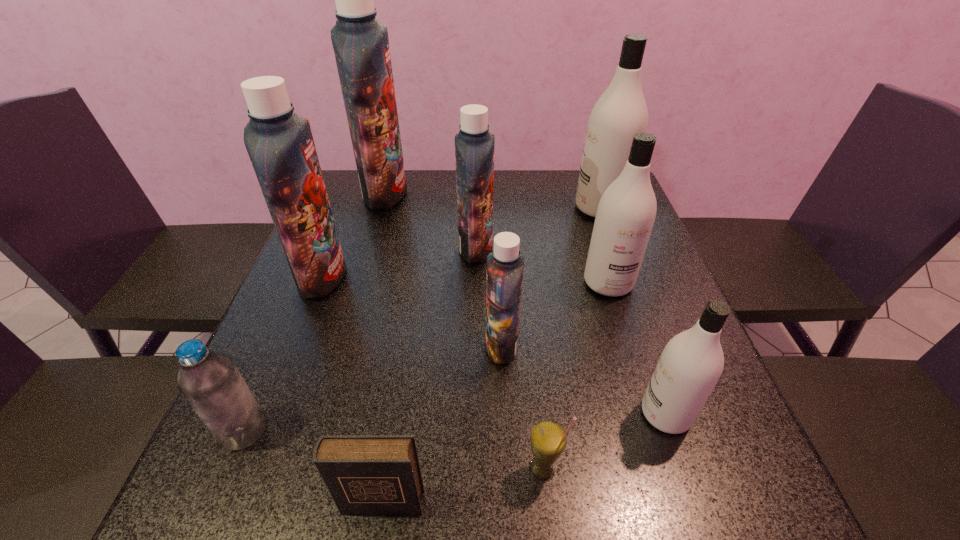
Where is `straw for drinking located at the near edge`? straw for drinking located at the near edge is located at coordinates (548, 438).

Locate an element on the screen. diary situated at the near edge is located at coordinates coord(365,474).

I want to click on water bottle that is at the left edge, so click(209, 380).

The height and width of the screenshot is (540, 960). What are the coordinates of `object that is at the far left corner` in the screenshot? It's located at (361, 45).

What are the coordinates of `object that is at the far right corner` in the screenshot? It's located at (621, 111).

Identify the location of vacant position at the far edge of the desktop. The width and height of the screenshot is (960, 540). (497, 199).

The image size is (960, 540). I want to click on free location at the near edge, so click(396, 526).

In the image, there is a desktop. Identify the location of vacant space at the left edge. (270, 428).

At what (x,y) coordinates should I click in order to perform the action: click on vacant space at the right edge of the desktop. Please return your answer as a coordinate pair (x, y). Looking at the image, I should click on (660, 320).

In the image, there is a desktop. Find the location of `vacant space at the far right corner`. vacant space at the far right corner is located at coordinates (576, 179).